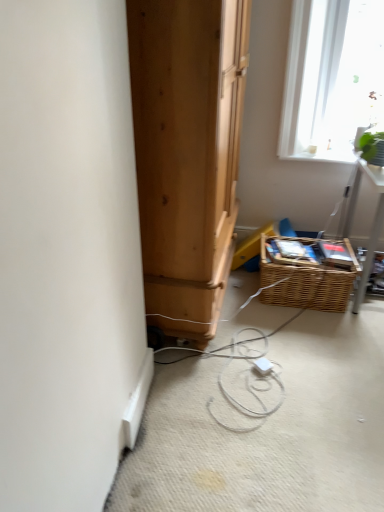
Question: Is woven brown basket at lower right positioned far away from white plastic extension cord at center?

Choices:
 (A) no
 (B) yes

Answer: (A)

Question: Can you confirm if woven brown basket at lower right is thinner than white plastic extension cord at center?

Choices:
 (A) no
 (B) yes

Answer: (A)

Question: From the image's perspective, is woven brown basket at lower right below white plastic extension cord at center?

Choices:
 (A) yes
 (B) no

Answer: (B)

Question: Could you tell me if woven brown basket at lower right is facing white plastic extension cord at center?

Choices:
 (A) yes
 (B) no

Answer: (A)

Question: Does woven brown basket at lower right have a larger size compared to white plastic extension cord at center?

Choices:
 (A) yes
 (B) no

Answer: (A)

Question: Is woven brown basket at lower right turned away from white plastic extension cord at center?

Choices:
 (A) no
 (B) yes

Answer: (A)

Question: Does white plastic extension cord at center have a greater height compared to green leafy plant at upper right?

Choices:
 (A) no
 (B) yes

Answer: (A)

Question: Can you confirm if white plastic extension cord at center is bigger than green leafy plant at upper right?

Choices:
 (A) no
 (B) yes

Answer: (A)

Question: Can green leafy plant at upper right be found inside white plastic extension cord at center?

Choices:
 (A) no
 (B) yes

Answer: (A)

Question: From the image's perspective, is white plastic extension cord at center beneath green leafy plant at upper right?

Choices:
 (A) no
 (B) yes

Answer: (B)

Question: Is white plastic extension cord at center outside green leafy plant at upper right?

Choices:
 (A) no
 (B) yes

Answer: (B)

Question: Does white plastic extension cord at center have a smaller size compared to green leafy plant at upper right?

Choices:
 (A) yes
 (B) no

Answer: (A)

Question: From the image's perspective, does white plastic extension cord at center appear lower than woven brown basket at lower right?

Choices:
 (A) yes
 (B) no

Answer: (A)